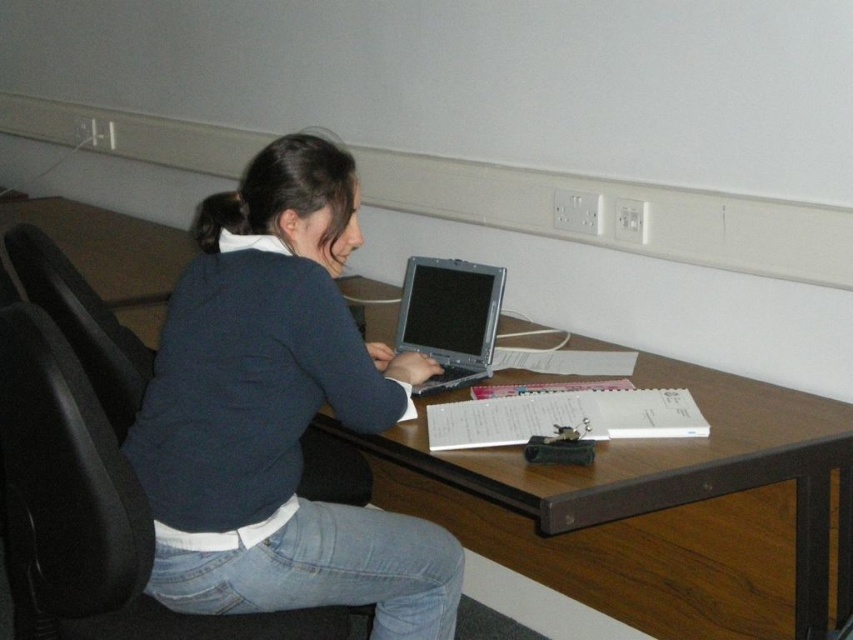
Does wooden at center appear on the right side of black leather swivel chair at left?

Indeed, wooden at center is positioned on the right side of black leather swivel chair at left.

Does wooden at center appear on the left side of black leather swivel chair at left?

In fact, wooden at center is to the right of black leather swivel chair at left.

Does point (728, 492) come closer to viewer compared to point (90, 538)?

That is False.

Image resolution: width=853 pixels, height=640 pixels. In order to click on wooden at center in this screenshot , I will do `click(642, 508)`.

Measure the distance between wooden at center and camera.

The distance of wooden at center from camera is 3.85 feet.

Does wooden at center appear on the left side of black leather chair at left?

No, wooden at center is not to the left of black leather chair at left.

Measure the distance between wooden at center and camera.

wooden at center and camera are 1.17 meters apart from each other.

What are the coordinates of `wooden at center` in the screenshot? It's located at (642, 508).

Who is higher up, dark blue sweater at center or black leather swivel chair at left?

Positioned higher is dark blue sweater at center.

Measure the distance from dark blue sweater at center to black leather swivel chair at left.

8.06 inches

This screenshot has height=640, width=853. What are the coordinates of `dark blue sweater at center` in the screenshot? It's located at (279, 413).